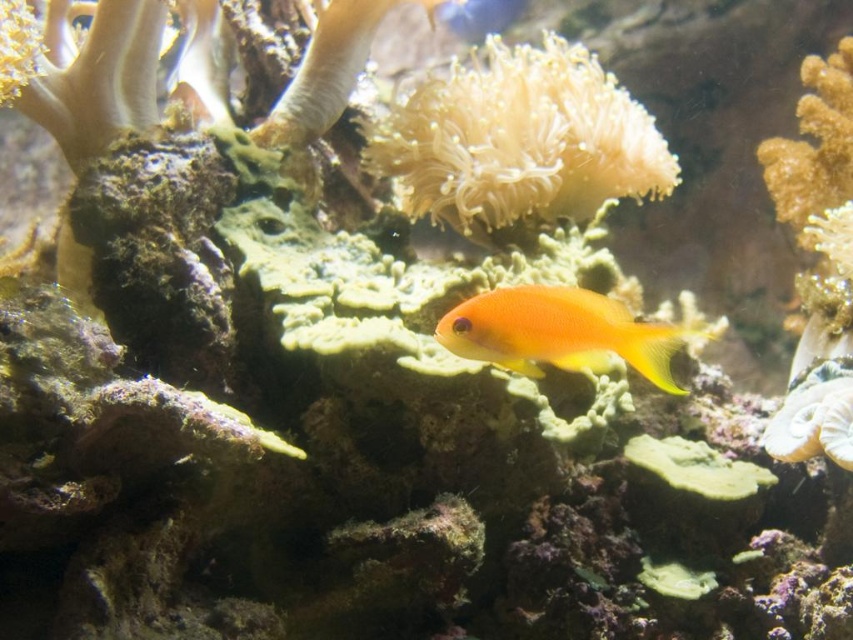
You are a marine biologist observing the underwater scene. You notice the soft white coral at center and the bright orange fish at center. Based on their positions, which one is closer to the surface of the water?

The soft white coral at center is above the bright orange fish at center, so it is closer to the surface of the water.

You are a marine biologist studying underwater formations. You observe the soft white coral at center in an underwater scene. Can you determine its exact coordinates in the image?

The soft white coral at center is located at coordinates point (520, 140).